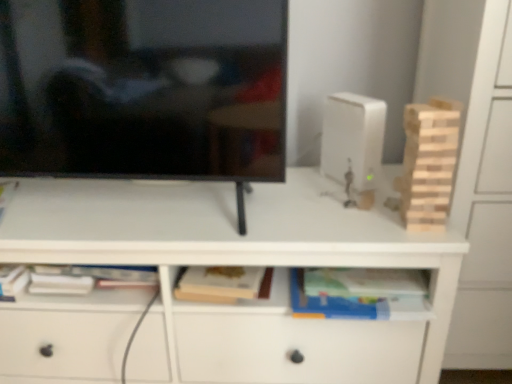
Question: Is hardcover book at center shorter than black glossy television at upper left?

Choices:
 (A) no
 (B) yes

Answer: (B)

Question: Considering the relative sizes of hardcover book at center and black glossy television at upper left in the image provided, is hardcover book at center taller than black glossy television at upper left?

Choices:
 (A) no
 (B) yes

Answer: (A)

Question: From a real-world perspective, is hardcover book at center beneath black glossy television at upper left?

Choices:
 (A) no
 (B) yes

Answer: (B)

Question: Is black glossy television at upper left at the back of hardcover book at center?

Choices:
 (A) yes
 (B) no

Answer: (B)

Question: Does hardcover book at center touch black glossy television at upper left?

Choices:
 (A) yes
 (B) no

Answer: (B)

Question: From the image's perspective, is hardcover book at center under black glossy television at upper left?

Choices:
 (A) no
 (B) yes

Answer: (B)

Question: Is light wood block tower at right oriented away from white matte desk at center?

Choices:
 (A) yes
 (B) no

Answer: (B)

Question: From a real-world perspective, does light wood block tower at right sit lower than white matte desk at center?

Choices:
 (A) no
 (B) yes

Answer: (A)

Question: Would you consider light wood block tower at right to be distant from white matte desk at center?

Choices:
 (A) no
 (B) yes

Answer: (A)

Question: Is light wood block tower at right further to the viewer compared to white matte desk at center?

Choices:
 (A) yes
 (B) no

Answer: (B)

Question: Is light wood block tower at right thinner than white matte desk at center?

Choices:
 (A) no
 (B) yes

Answer: (B)

Question: Can you confirm if light wood block tower at right is smaller than white matte desk at center?

Choices:
 (A) no
 (B) yes

Answer: (B)

Question: From a real-world perspective, is light wood block tower at right positioned under black glossy television at upper left based on gravity?

Choices:
 (A) yes
 (B) no

Answer: (A)